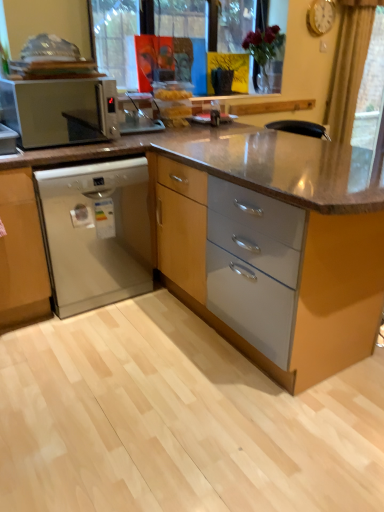
Question: Is white plastic microwave at left not within beige fabric curtain at upper right?

Choices:
 (A) no
 (B) yes

Answer: (B)

Question: Considering the relative sizes of white plastic microwave at left and beige fabric curtain at upper right in the image provided, is white plastic microwave at left bigger than beige fabric curtain at upper right?

Choices:
 (A) no
 (B) yes

Answer: (A)

Question: Does white plastic microwave at left have a greater width compared to beige fabric curtain at upper right?

Choices:
 (A) no
 (B) yes

Answer: (B)

Question: Is white plastic microwave at left positioned in front of beige fabric curtain at upper right?

Choices:
 (A) yes
 (B) no

Answer: (A)

Question: From the image's perspective, would you say white plastic microwave at left is shown under beige fabric curtain at upper right?

Choices:
 (A) yes
 (B) no

Answer: (A)

Question: Is white plastic microwave at left shorter than beige fabric curtain at upper right?

Choices:
 (A) no
 (B) yes

Answer: (B)

Question: From a real-world perspective, is satin silver dishwasher at lower left located higher than white plastic microwave at left?

Choices:
 (A) no
 (B) yes

Answer: (A)

Question: Is satin silver dishwasher at lower left completely or partially outside of white plastic microwave at left?

Choices:
 (A) yes
 (B) no

Answer: (A)

Question: Is the surface of satin silver dishwasher at lower left in direct contact with white plastic microwave at left?

Choices:
 (A) yes
 (B) no

Answer: (B)

Question: Considering the relative sizes of satin silver dishwasher at lower left and white plastic microwave at left in the image provided, is satin silver dishwasher at lower left taller than white plastic microwave at left?

Choices:
 (A) yes
 (B) no

Answer: (A)

Question: Is satin silver dishwasher at lower left wider than white plastic microwave at left?

Choices:
 (A) no
 (B) yes

Answer: (B)

Question: Is satin silver dishwasher at lower left behind white plastic microwave at left?

Choices:
 (A) no
 (B) yes

Answer: (B)

Question: Is matte wood cabinet at center outside satin silver dishwasher at lower left?

Choices:
 (A) no
 (B) yes

Answer: (B)